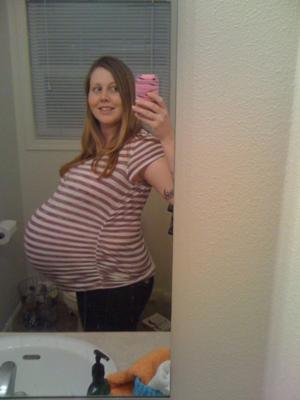
What are the coordinates of `handsoap dispenser` in the screenshot? It's located at (99, 384).